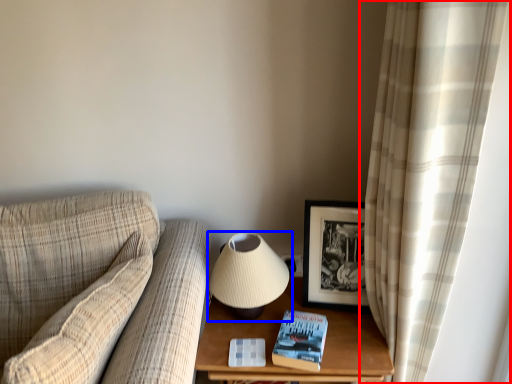
Question: Which object appears closest to the camera in this image, curtain (highlighted by a red box) or lamp (highlighted by a blue box)?

Choices:
 (A) curtain
 (B) lamp

Answer: (A)